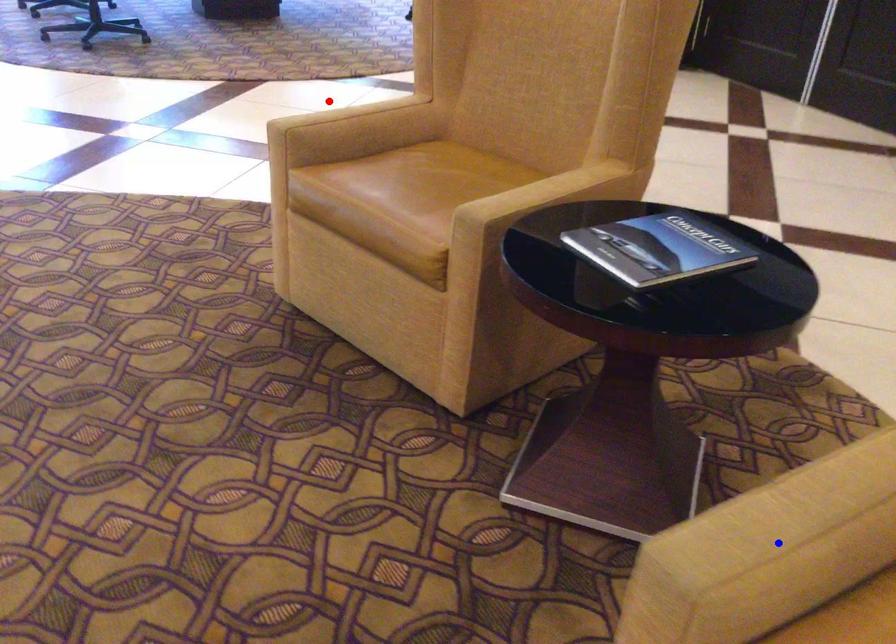
Question: Two points are marked on the image. Which point is closer to the camera?

Choices:
 (A) Blue point is closer.
 (B) Red point is closer.

Answer: (A)